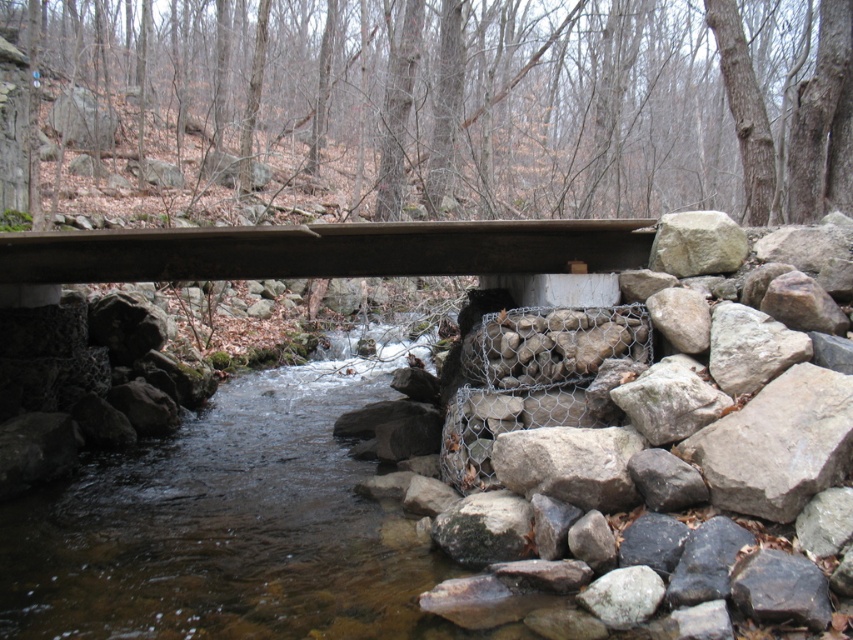
Question: Is brown wooden bridge at center to the right of gray rough rock at right from the viewer's perspective?

Choices:
 (A) no
 (B) yes

Answer: (A)

Question: Among these points, which one is farthest from the camera?

Choices:
 (A) (683, 253)
 (B) (386, 269)

Answer: (B)

Question: Can you confirm if brown wooden bridge at center is bigger than gray rough rock at right?

Choices:
 (A) no
 (B) yes

Answer: (B)

Question: Does brown wooden bridge at center come in front of gray rough rock at right?

Choices:
 (A) yes
 (B) no

Answer: (A)

Question: Which object appears farthest from the camera in this image?

Choices:
 (A) brown wooden bridge at center
 (B) gray rough rock at right

Answer: (B)

Question: Which object is closer to the camera taking this photo?

Choices:
 (A) brown wooden bridge at center
 (B) gray rough rock at right

Answer: (A)